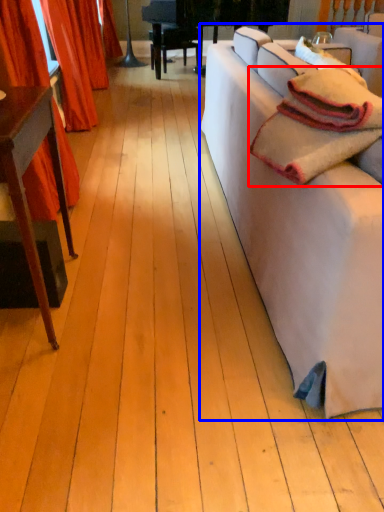
Question: Among these objects, which one is farthest to the camera, blanket (highlighted by a red box) or studio couch (highlighted by a blue box)?

Choices:
 (A) blanket
 (B) studio couch

Answer: (A)